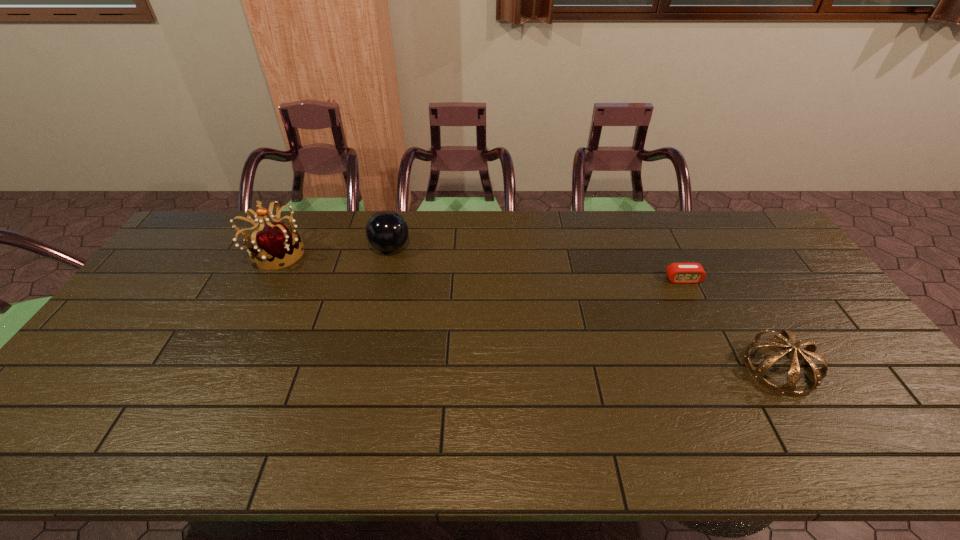
Where is `the leftmost object`? the leftmost object is located at coordinates (274, 243).

The width and height of the screenshot is (960, 540). I want to click on the tallest object, so click(274, 243).

You are a GUI agent. You are given a task and a screenshot of the screen. Output one action in this format:
    pyautogui.click(x=<x>, y=<y>)
    Task: Click on the third object from right to left
    This screenshot has width=960, height=540.
    Given the screenshot: What is the action you would take?
    pyautogui.click(x=387, y=231)

The height and width of the screenshot is (540, 960). In order to click on the second tallest object in this screenshot , I will do `click(387, 231)`.

At what (x,y) coordinates should I click in order to perform the action: click on the second shortest object. Please return your answer as a coordinate pair (x, y). Looking at the image, I should click on (788, 388).

Find the location of a particular element. Image resolution: width=960 pixels, height=540 pixels. the nearest object is located at coordinates (788, 388).

Image resolution: width=960 pixels, height=540 pixels. In order to click on alarm clock in this screenshot , I will do `click(682, 273)`.

Identify the location of vacant region located on the front-facing side of the left tiara. The image size is (960, 540). (378, 253).

The height and width of the screenshot is (540, 960). Identify the location of vacant space positioned on the side of the third shortest object with the finger holes. (431, 247).

Where is `blank space located on the back of the shorter tiara`? Image resolution: width=960 pixels, height=540 pixels. blank space located on the back of the shorter tiara is located at coordinates (708, 249).